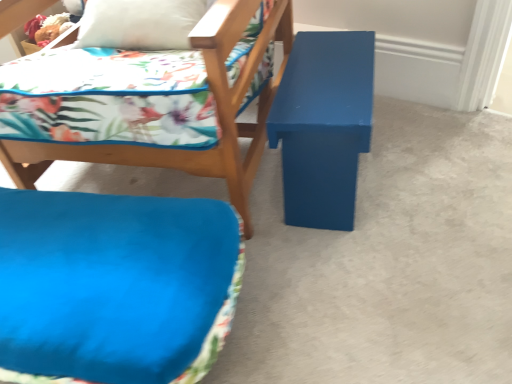
Where is `vacant area that is in front of matte blue bench at right`? The height and width of the screenshot is (384, 512). vacant area that is in front of matte blue bench at right is located at coordinates [369, 259].